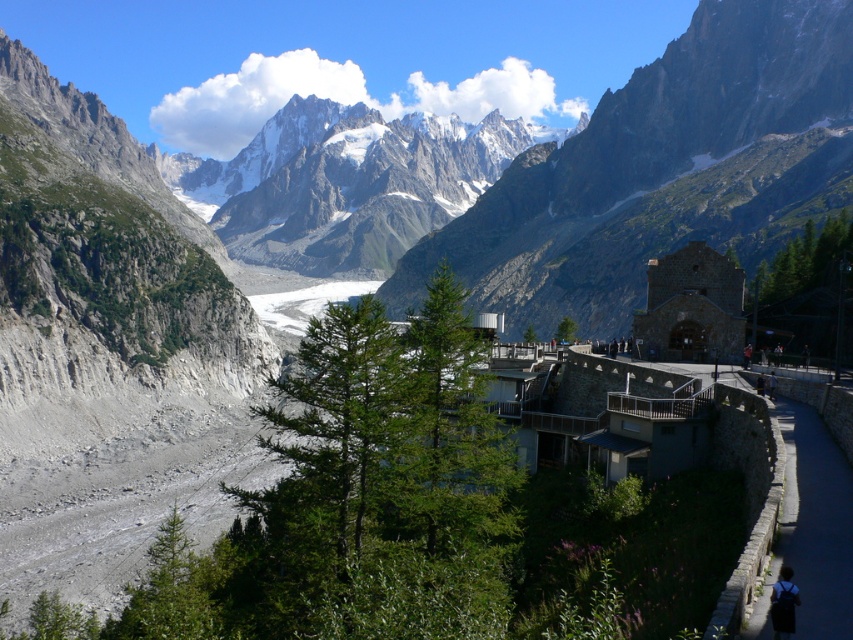
Describe the element at coordinates (660, 170) in the screenshot. I see `gray rock mountain range at upper center` at that location.

Who is taller, gray rock mountain range at upper center or black fabric backpack at lower right?

Standing taller between the two is gray rock mountain range at upper center.

Is point (602, 288) less distant than point (776, 579)?

No, it is behind (776, 579).

Find the location of a particular element. gray rock mountain range at upper center is located at coordinates (660, 170).

Between rugged stone mountain at center and black fabric backpack at lower right, which one appears on the right side from the viewer's perspective?

From the viewer's perspective, rugged stone mountain at center appears more on the right side.

Is point (606, 157) behind point (780, 618)?

Yes, it is.

Does point (642, 84) come farther from viewer compared to point (787, 609)?

That is True.

This screenshot has width=853, height=640. Find the location of `rugged stone mountain at center`. rugged stone mountain at center is located at coordinates (660, 170).

This screenshot has width=853, height=640. Find the location of `dark gray stone wall at lower right`. dark gray stone wall at lower right is located at coordinates (811, 525).

Does point (799, 456) come farther from viewer compared to point (786, 586)?

That is True.

Locate an element on the screen. dark gray stone wall at lower right is located at coordinates (811, 525).